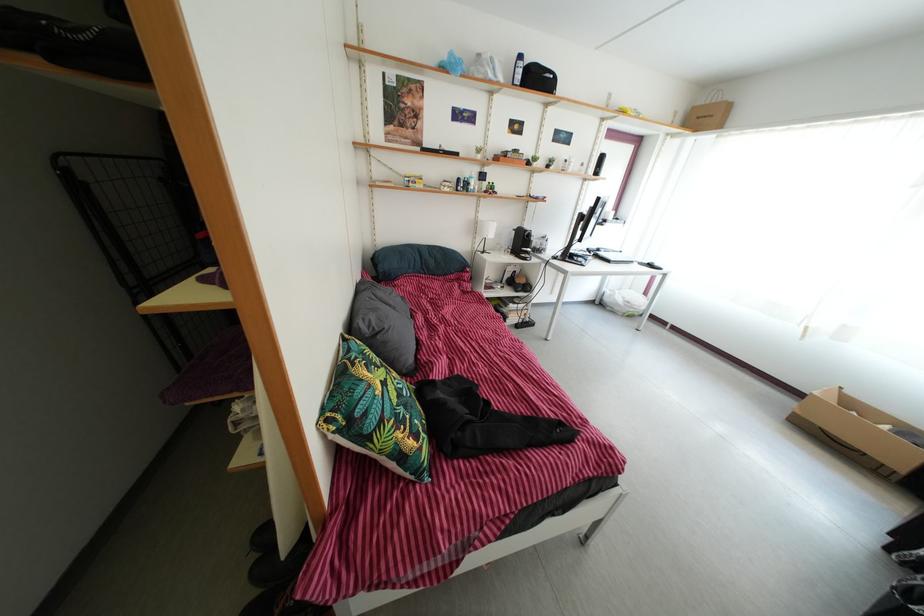
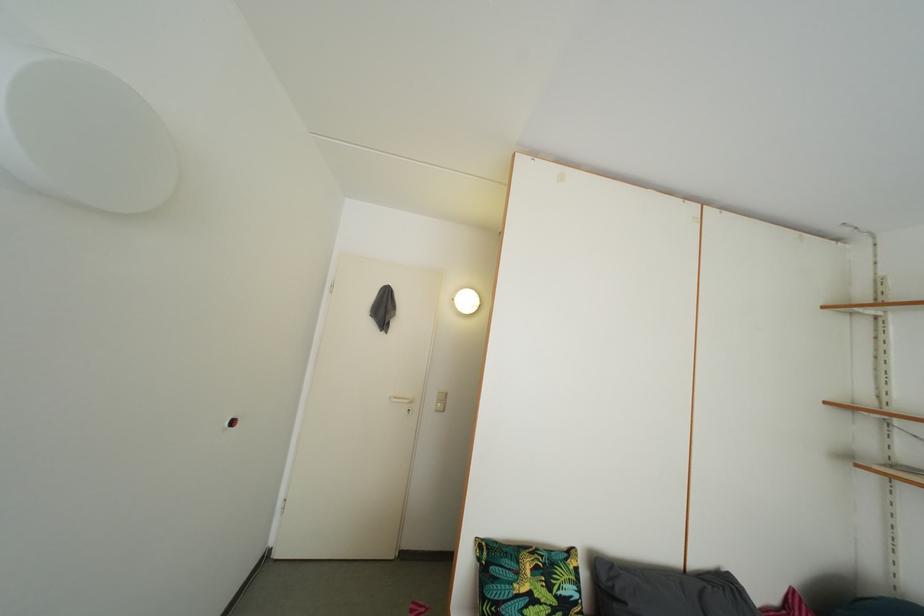
The point at (383, 338) is marked in the first image. Where is the corresponding point in the second image?

(624, 601)